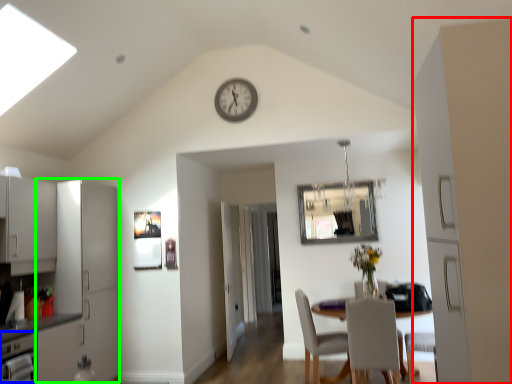
Question: Which object is positioned closest to side (highlighted by a red box)? Select from dish washer (highlighted by a blue box) and cabinetry (highlighted by a green box).

Choices:
 (A) dish washer
 (B) cabinetry

Answer: (A)